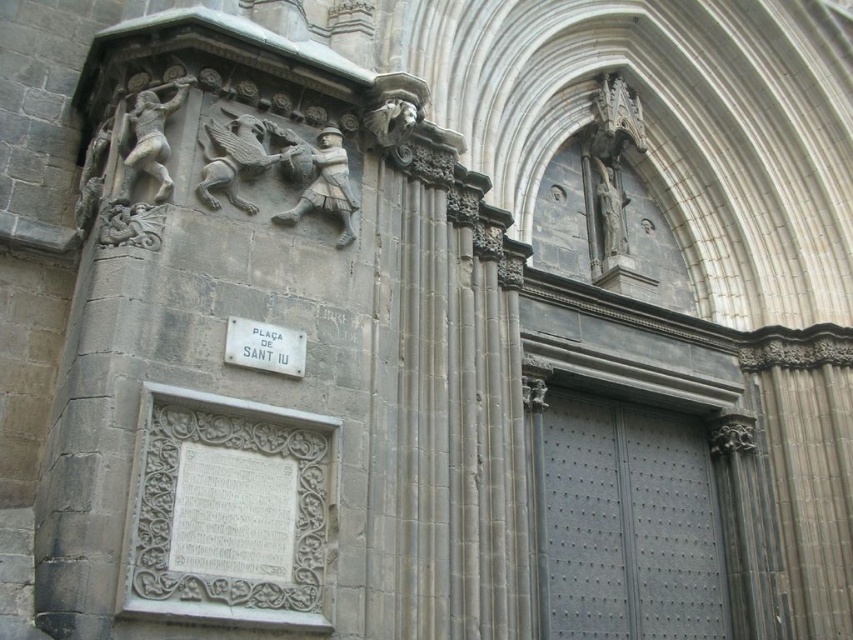
Question: Is gray metallic door at center further to camera compared to white metal plaque at lower left?

Choices:
 (A) yes
 (B) no

Answer: (A)

Question: Is white metal plaque at lower left below white stone plaque at center?

Choices:
 (A) no
 (B) yes

Answer: (A)

Question: Does gray metallic door at center have a smaller size compared to white metal plaque at lower left?

Choices:
 (A) yes
 (B) no

Answer: (B)

Question: Which is farther from the white metal plaque at lower left?

Choices:
 (A) gray metallic door at center
 (B) white stone plaque at center

Answer: (A)

Question: Which point is farther to the camera?

Choices:
 (A) (279, 342)
 (B) (245, 321)

Answer: (A)

Question: Estimate the real-world distances between objects in this image. Which object is closer to the gray metallic door at center?

Choices:
 (A) white metal plaque at lower left
 (B) white stone plaque at center

Answer: (B)